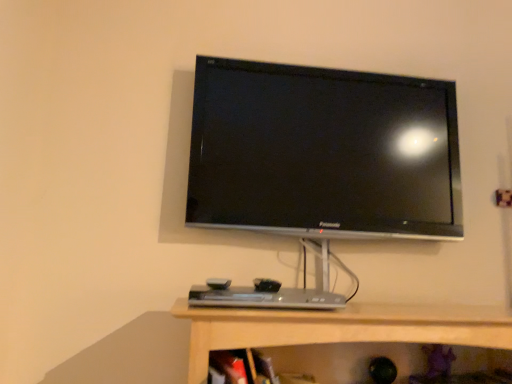
Question: From a real-world perspective, is silver metallic desktop at center positioned above or below black glossy tv at upper center?

Choices:
 (A) below
 (B) above

Answer: (A)

Question: Relative to black glossy tv at upper center, is silver metallic desktop at center in front or behind?

Choices:
 (A) front
 (B) behind

Answer: (A)

Question: Based on their positions, is silver metallic desktop at center located to the left or right of black glossy tv at upper center?

Choices:
 (A) left
 (B) right

Answer: (A)

Question: Considering the positions of black glossy tv at upper center and silver metallic desktop at center in the image, is black glossy tv at upper center wider or thinner than silver metallic desktop at center?

Choices:
 (A) wide
 (B) thin

Answer: (B)

Question: Is point (284, 148) positioned closer to the camera than point (313, 289)?

Choices:
 (A) closer
 (B) farther

Answer: (B)

Question: In terms of height, does black glossy tv at upper center look taller or shorter compared to silver metallic desktop at center?

Choices:
 (A) short
 (B) tall

Answer: (B)

Question: Would you say black glossy tv at upper center is to the left or to the right of silver metallic desktop at center in the picture?

Choices:
 (A) right
 (B) left

Answer: (A)